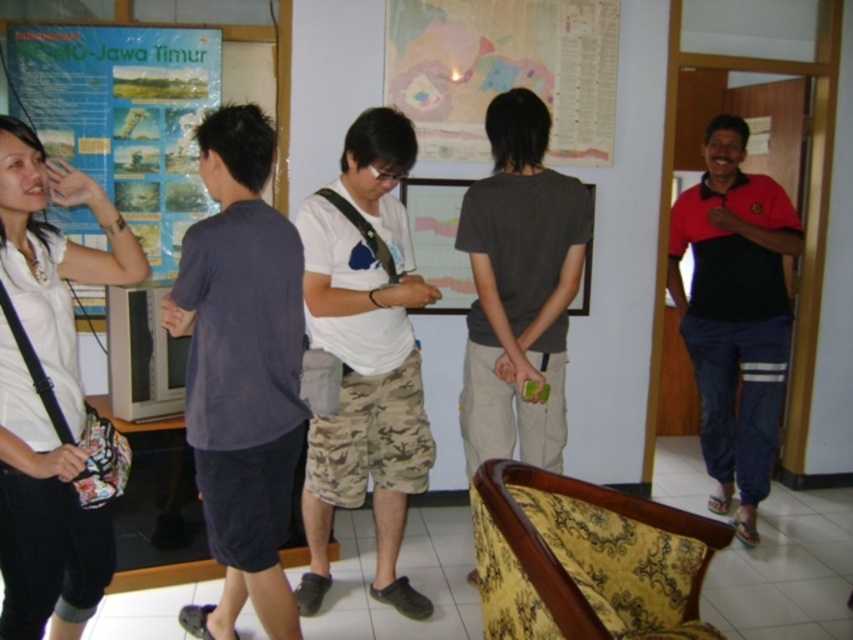
Looking at the two shirts in the scene, the white cotton shirt at center and the black cotton shirt at right, which one is positioned more to the left?

The white cotton shirt at center is positioned more to the left than the black cotton shirt at right.

You are standing in the room and want to hand a document to both the person wearing the white cotton shirt at center and the matte gray shirt at center. Since you can only approach one at a time, which one should you approach first if you want to minimize the distance walked?

You should approach the white cotton shirt at center first because it is positioned to the left of the matte gray shirt at center, so it is closer to your starting position on the left side of the image.